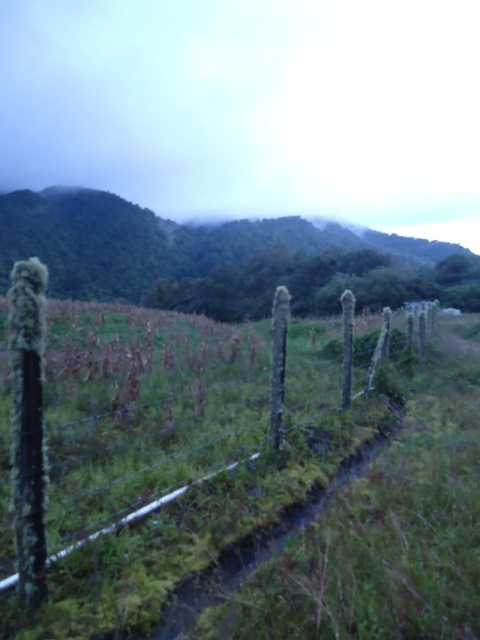
Question: Does green mossy wood fence at center have a smaller size compared to green mossy fence at lower left?

Choices:
 (A) yes
 (B) no

Answer: (A)

Question: Which of the following is the farthest from the observer?

Choices:
 (A) (315, 275)
 (B) (195, 538)

Answer: (A)

Question: Does green mossy wood fence at center have a larger size compared to green mossy fence at lower left?

Choices:
 (A) yes
 (B) no

Answer: (B)

Question: Does green mossy wood fence at center appear on the left side of green mossy fence at lower left?

Choices:
 (A) no
 (B) yes

Answer: (A)